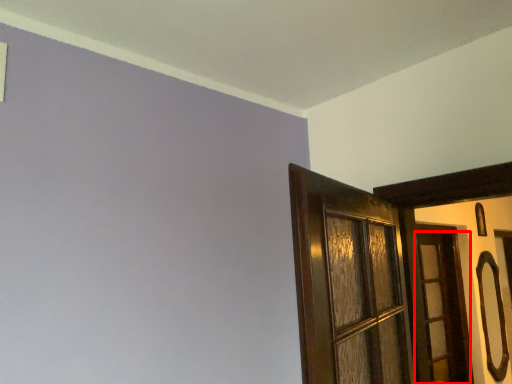
Question: From the image, what is the correct spatial relationship of door (annotated by the red box) in relation to door handle?

Choices:
 (A) left
 (B) right

Answer: (A)